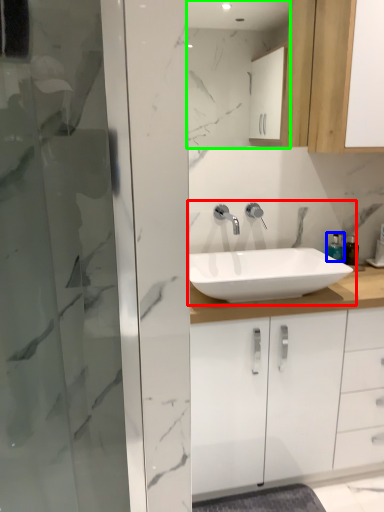
Question: Which is farther away from sink (highlighted by a red box)? soap dispenser (highlighted by a blue box) or mirror (highlighted by a green box)?

Choices:
 (A) soap dispenser
 (B) mirror

Answer: (B)